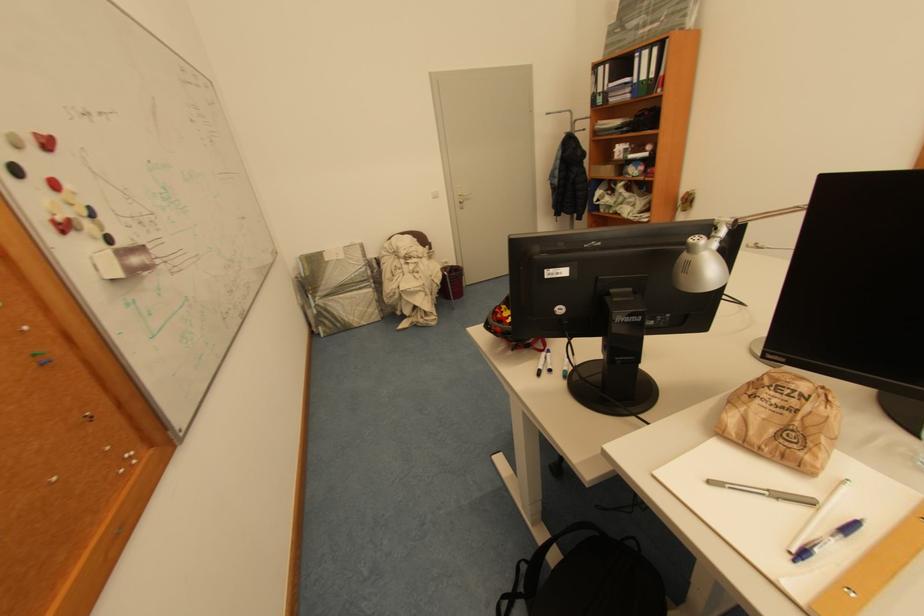
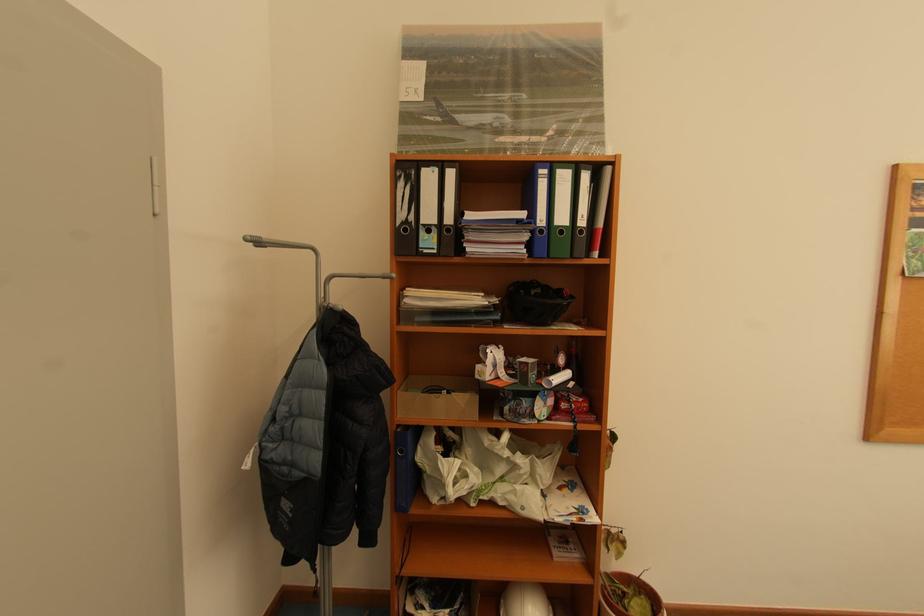
Locate, in the second image, the point that corresponds to point (601, 92) in the first image.

(409, 217)